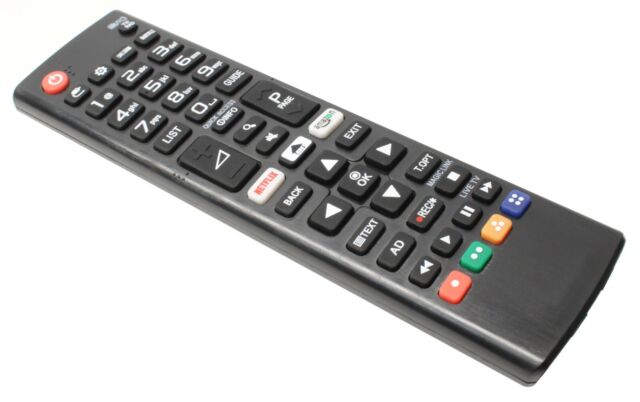
This screenshot has height=402, width=640. I want to click on number buttons on remote control, so click(x=97, y=102), click(x=136, y=75), click(x=157, y=53), click(x=184, y=55), click(x=162, y=73), click(x=147, y=127), click(x=177, y=99), click(x=208, y=65), click(x=205, y=98).